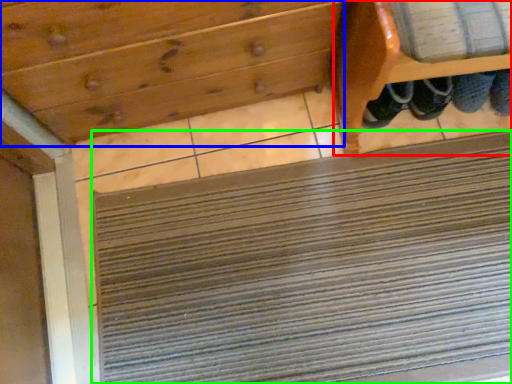
Question: Which is nearer to the furniture (highlighted by a red box)? drawer (highlighted by a blue box) or doormat (highlighted by a green box).

Choices:
 (A) drawer
 (B) doormat

Answer: (A)